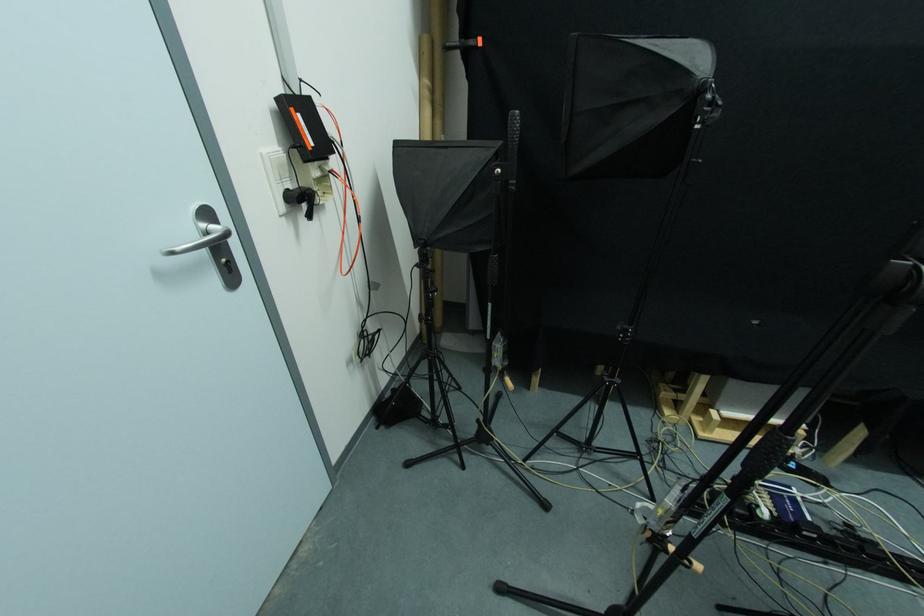
Find where to turn the tripod adjustment knob. Please return your answer as a coordinate pair (x, y).

(295, 196)